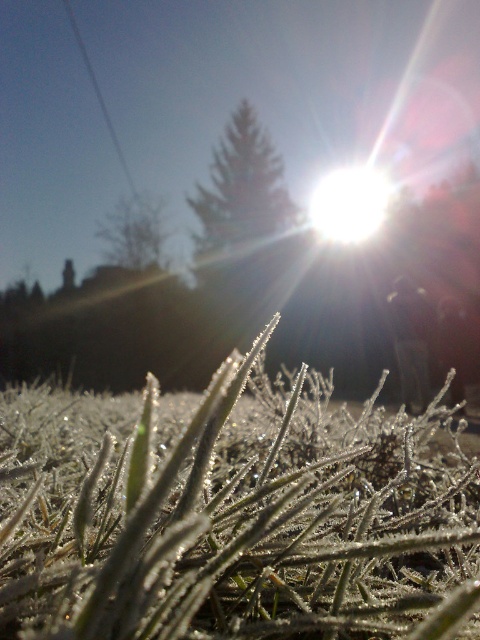
Question: Which point is farther from the camera taking this photo?

Choices:
 (A) (283, 209)
 (B) (127, 232)
 (C) (158, 611)

Answer: (A)

Question: Is frosted glass at center positioned behind green matte tree at upper center?

Choices:
 (A) yes
 (B) no

Answer: (B)

Question: Which object is closer to the camera taking this photo?

Choices:
 (A) green matte tree at upper center
 (B) green textured pine tree at center

Answer: (B)

Question: Is frosted glass at center bigger than green textured pine tree at center?

Choices:
 (A) no
 (B) yes

Answer: (A)

Question: Which of the following is the farthest from the observer?

Choices:
 (A) frosted glass at center
 (B) green textured pine tree at center
 (C) green matte tree at upper center

Answer: (C)

Question: Can you confirm if frosted glass at center is positioned to the right of green textured pine tree at center?

Choices:
 (A) no
 (B) yes

Answer: (B)